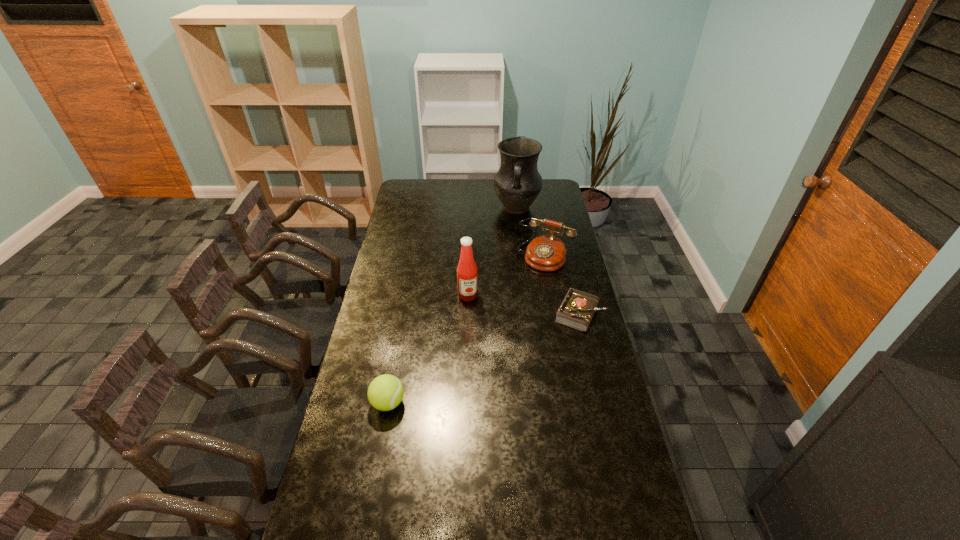
This screenshot has width=960, height=540. Identify the location of object located in the far edge section of the desktop. (517, 183).

You are a GUI agent. You are given a task and a screenshot of the screen. Output one action in this format:
    pyautogui.click(x=<x>, y=<y>)
    Task: Click on the object present at the left edge
    This screenshot has height=540, width=960.
    Given the screenshot: What is the action you would take?
    pyautogui.click(x=385, y=392)

I want to click on diary that is at the right edge, so click(577, 310).

Locate an element on the screen. pitcher that is at the right edge is located at coordinates (517, 183).

Where is `telephone located in the right edge section of the desktop`? telephone located in the right edge section of the desktop is located at coordinates (546, 252).

The image size is (960, 540). Find the location of `object that is at the far right corner`. object that is at the far right corner is located at coordinates (517, 183).

Find the location of a particular element. This screenshot has height=540, width=960. vacant point at the far edge is located at coordinates (428, 197).

What are the coordinates of `vacant space at the near edge of the desktop` in the screenshot? It's located at (494, 522).

The width and height of the screenshot is (960, 540). Find the location of `vacant space at the left edge of the desktop`. vacant space at the left edge of the desktop is located at coordinates (362, 475).

Where is `free space at the right edge of the desktop`? The image size is (960, 540). free space at the right edge of the desktop is located at coordinates (567, 357).